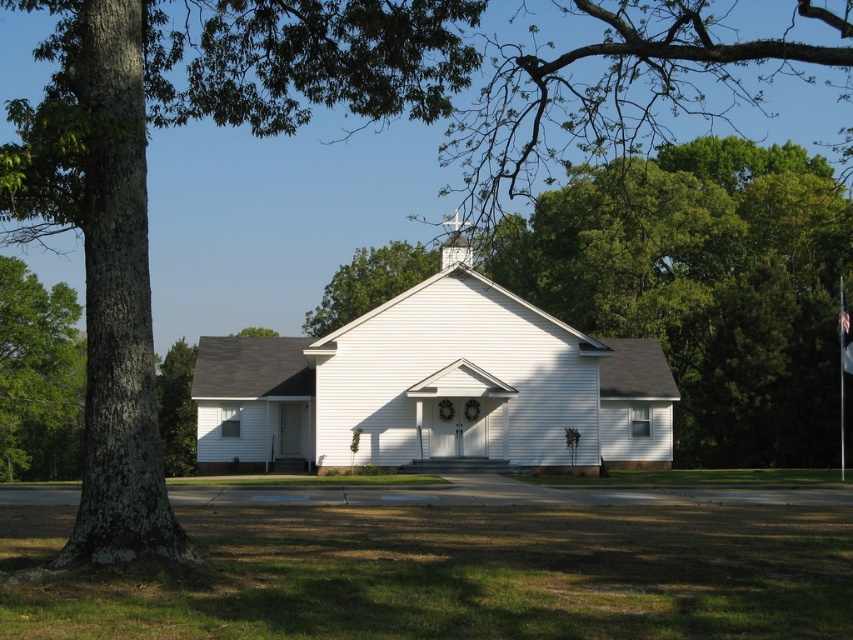
You are standing at the point marked by the coordinates point (38,376). Looking towards the church, can you see the central entrance of the church? Please explain why.

The point (38,376) marks the green leafy tree at left. Since the tree trunk is in the foreground and partially obscures the view of the church, standing at this point would block your direct line of sight to the central entrance of the church.

You are standing in front of the church and notice the green rough bark tree at left and the white wood spire at upper center. Which object is positioned higher in the image?

The green rough bark tree at left is located above the white wood spire at upper center, so it is positioned higher in the image.

You are standing in front of the white wood church at center and the green leafy tree at left. Which one appears taller to you?

The green leafy tree at left appears taller than the white wood church at center because the white wood church at center is not as tall as the green leafy tree at left.